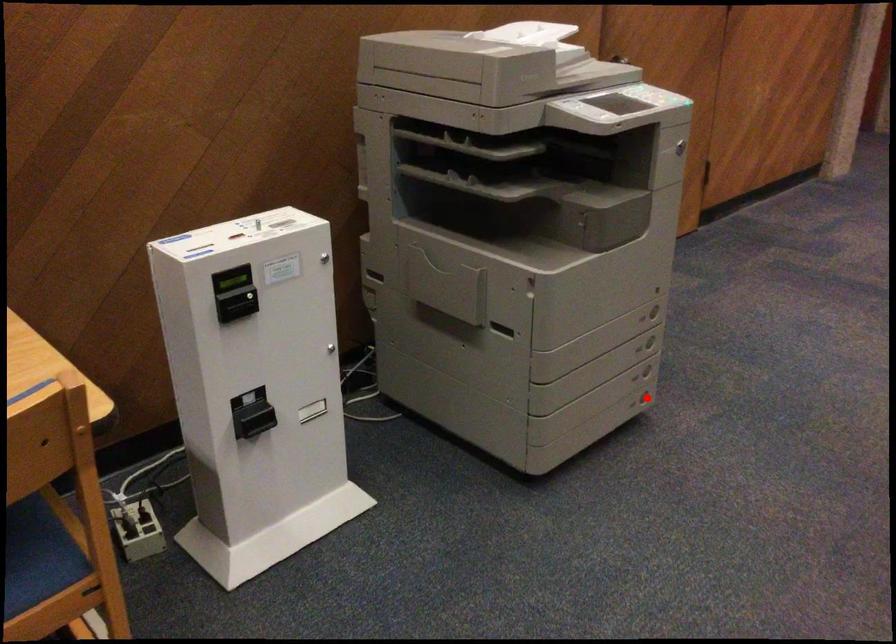
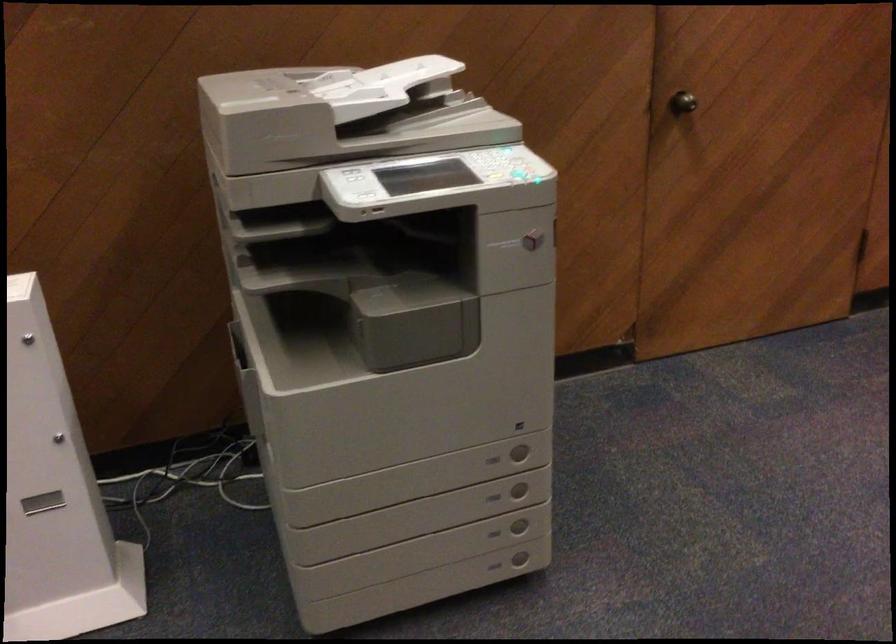
Question: I am providing you with two images of the same scene from different viewpoints. In image1, a red point is highlighted. Considering the same 3D point in image2, which of the following is correct?

Choices:
 (A) It is closer
 (B) It is farther

Answer: (A)